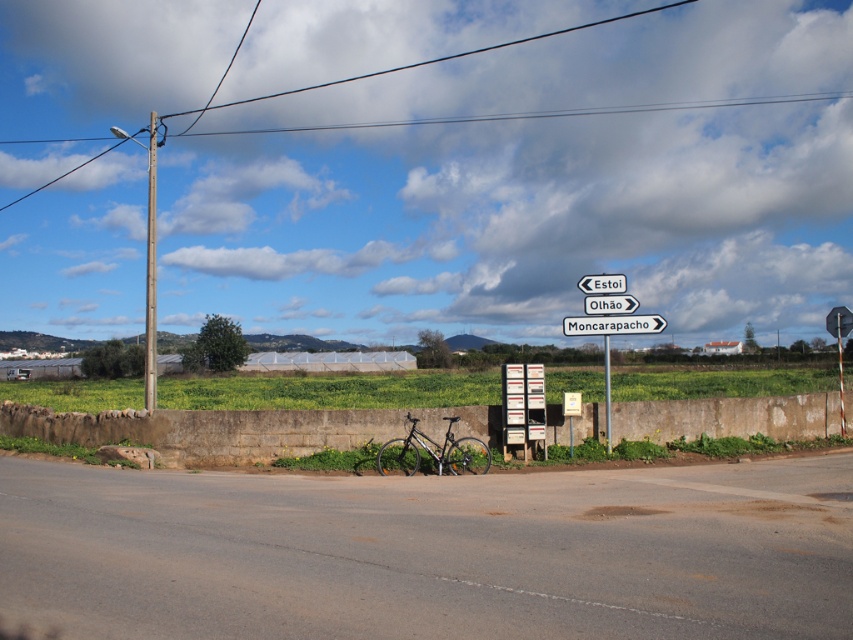
Can you confirm if white plastic signpost at center is thinner than metallic pole at left?

Yes.

Measure the distance between white plastic signpost at center and camera.

white plastic signpost at center and camera are 15.41 meters apart from each other.

Who is more distant from viewer, (583,326) or (144,401)?

Point (144,401)

In order to click on white plastic signpost at center in this screenshot , I will do `click(608, 321)`.

Is silver metallic bicycle at center positioned in front of metallic pole at left?

Yes, silver metallic bicycle at center is closer to the viewer.

Between silver metallic bicycle at center and metallic pole at left, which one appears on the left side from the viewer's perspective?

metallic pole at left

The height and width of the screenshot is (640, 853). What do you see at coordinates (433, 452) in the screenshot?
I see `silver metallic bicycle at center` at bounding box center [433, 452].

Locate an element on the screen. silver metallic bicycle at center is located at coordinates (433, 452).

In the scene shown: Which of these two, metallic wire at upper center or white plastic sign at center, stands taller?

Standing taller between the two is metallic wire at upper center.

Does metallic wire at upper center have a larger size compared to white plastic sign at center?

Yes.

Where is `metallic wire at upper center`? This screenshot has height=640, width=853. metallic wire at upper center is located at coordinates (412, 61).